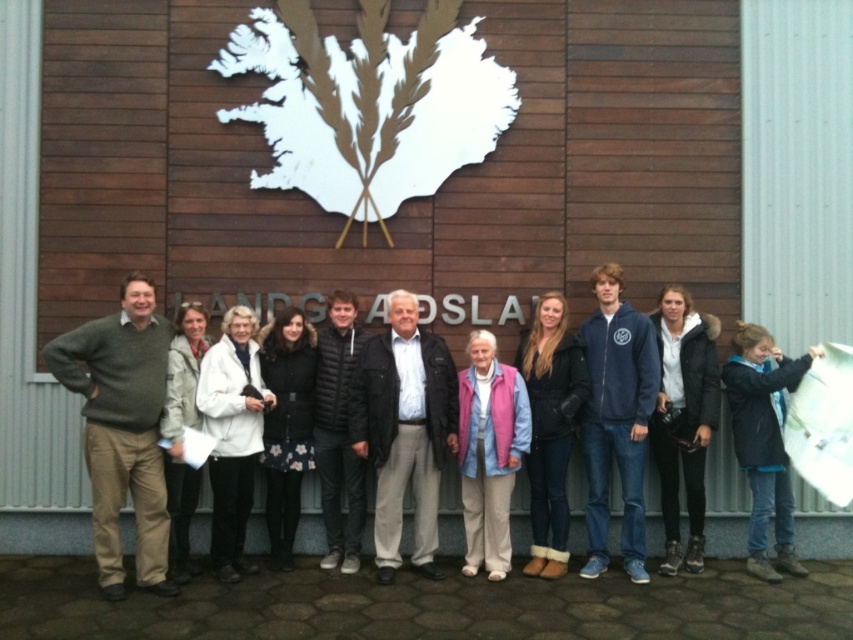
Measure the distance from navy blue zip-up jacket at center to black puffer jacket at center.

navy blue zip-up jacket at center and black puffer jacket at center are 6.88 feet apart from each other.

Who is shorter, navy blue zip-up jacket at center or black puffer jacket at center?

Standing shorter between the two is black puffer jacket at center.

Does point (636, 344) lie behind point (325, 516)?

No.

I want to click on navy blue zip-up jacket at center, so click(x=616, y=419).

Does green sweater at left appear on the right side of navy blue zip-up jacket at center?

Incorrect, green sweater at left is not on the right side of navy blue zip-up jacket at center.

Which is below, green sweater at left or navy blue zip-up jacket at center?

Answer: green sweater at left is below.

The width and height of the screenshot is (853, 640). I want to click on green sweater at left, so click(122, 429).

This screenshot has width=853, height=640. What are the coordinates of `green sweater at left` in the screenshot? It's located at (122, 429).

Who is positioned more to the right, dark gray jacket at center or black puffer jacket at center?

Positioned to the right is dark gray jacket at center.

Is point (428, 541) positioned before point (321, 356)?

Yes.

The height and width of the screenshot is (640, 853). What do you see at coordinates (404, 429) in the screenshot?
I see `dark gray jacket at center` at bounding box center [404, 429].

The image size is (853, 640). I want to click on dark gray jacket at center, so click(x=404, y=429).